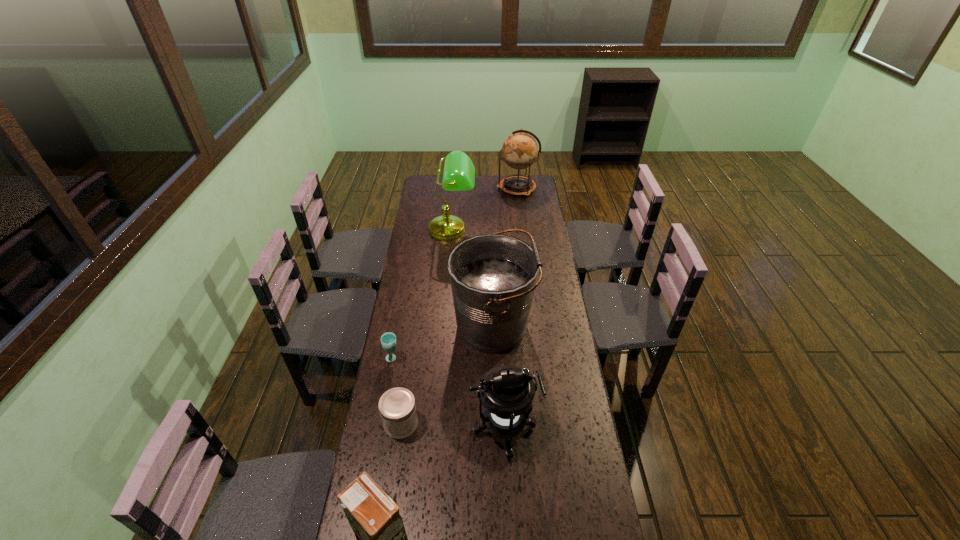
Identify the location of the second farthest object. 459,172.

At what (x,y) coordinates should I click in order to perform the action: click on globe. Please return your answer as a coordinate pair (x, y). The image size is (960, 540). Looking at the image, I should click on (519, 150).

Image resolution: width=960 pixels, height=540 pixels. What are the coordinates of `bucket` in the screenshot? It's located at (493, 277).

Locate an element on the screen. The width and height of the screenshot is (960, 540). lantern is located at coordinates (507, 392).

Identify the location of jar. The image size is (960, 540). (397, 407).

Identify the location of glass. This screenshot has width=960, height=540. (388, 340).

Locate an element on the screen. This screenshot has height=540, width=960. vacant area situated 0.270m on the desk next to the lamp is located at coordinates (447, 281).

Image resolution: width=960 pixels, height=540 pixels. Find the location of `free space located 0.340m at the center of the farthest object`. free space located 0.340m at the center of the farthest object is located at coordinates (441, 189).

This screenshot has width=960, height=540. Identify the location of free region located 0.220m at the center of the farthest object. (460, 189).

Identify the location of free location located 0.240m at the center of the farthest object. The height and width of the screenshot is (540, 960). (457, 189).